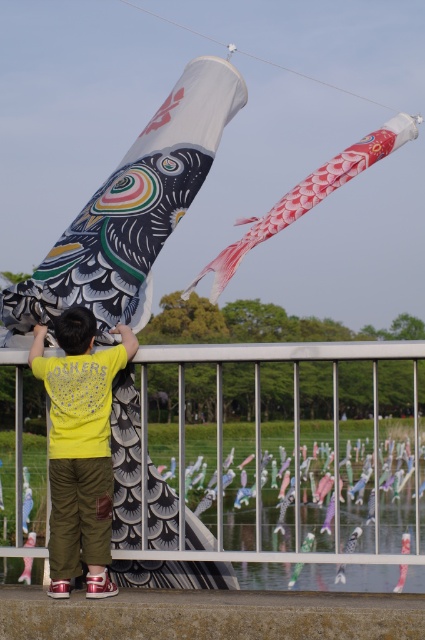
Question: Which object is the closest to the yellow cotton shirt at center?

Choices:
 (A) red textured fabric kite at upper center
 (B) metallic silver fence at lower center

Answer: (B)

Question: Can you confirm if yellow cotton shirt at center is thinner than red textured fabric kite at upper center?

Choices:
 (A) no
 (B) yes

Answer: (B)

Question: Is metallic silver fence at lower center above yellow cotton shirt at center?

Choices:
 (A) no
 (B) yes

Answer: (A)

Question: Can you confirm if metallic silver fence at lower center is thinner than red textured fabric kite at upper center?

Choices:
 (A) no
 (B) yes

Answer: (A)

Question: Which point appears farthest from the camera in this image?

Choices:
 (A) (62, 371)
 (B) (342, 355)
 (C) (385, 140)

Answer: (C)

Question: Which object is the closest to the metallic silver fence at lower center?

Choices:
 (A) yellow cotton shirt at center
 (B) red textured fabric kite at upper center

Answer: (A)